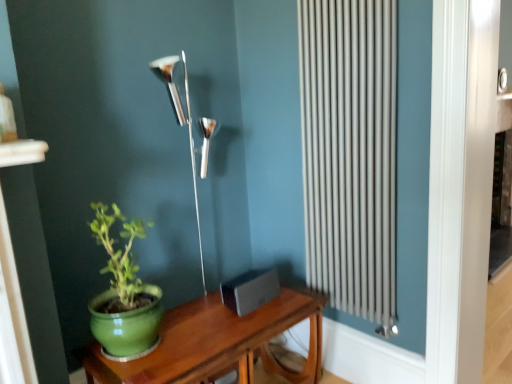
Question: From a real-world perspective, is silver metallic radiator at right positioned above or below polished silver lamp at center?

Choices:
 (A) below
 (B) above

Answer: (B)

Question: Is point (305, 79) positioned closer to the camera than point (184, 115)?

Choices:
 (A) closer
 (B) farther

Answer: (A)

Question: Which of these objects is positioned closest to the silver metallic radiator at right?

Choices:
 (A) polished silver lamp at center
 (B) green matte pot at left
 (C) green wood table at lower left

Answer: (C)

Question: Estimate the real-world distances between objects in this image. Which object is farther from the polished silver lamp at center?

Choices:
 (A) green matte pot at left
 (B) silver metallic radiator at right
 (C) green wood table at lower left

Answer: (B)